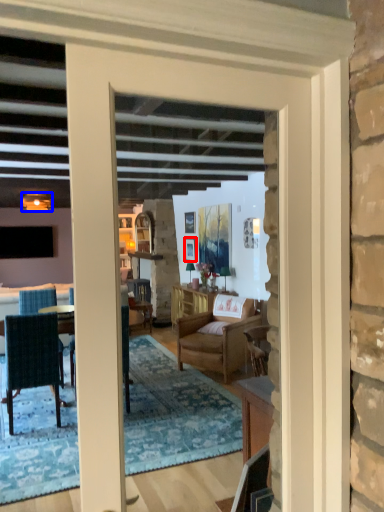
Question: Which of the following is the closest to the observer, picture frame (highlighted by a red box) or lamp (highlighted by a blue box)?

Choices:
 (A) picture frame
 (B) lamp

Answer: (B)